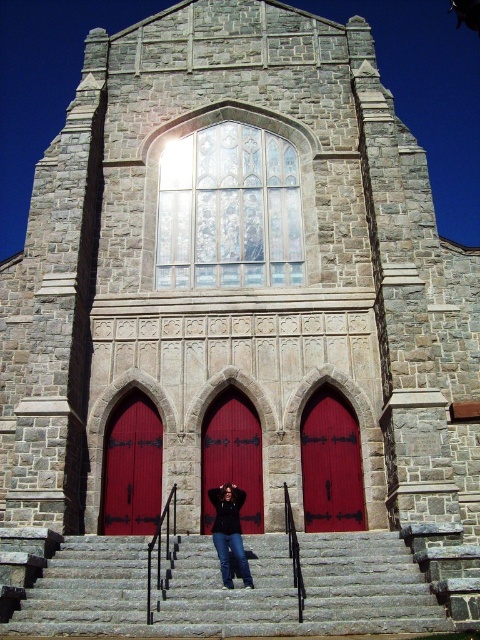
You are standing in front of the grand stone church and want to enter through the doors. Which door, the smooth glossy red door at center or the smooth glossy wood door at center, is taller?

The smooth glossy wood door at center is taller than the smooth glossy red door at center.